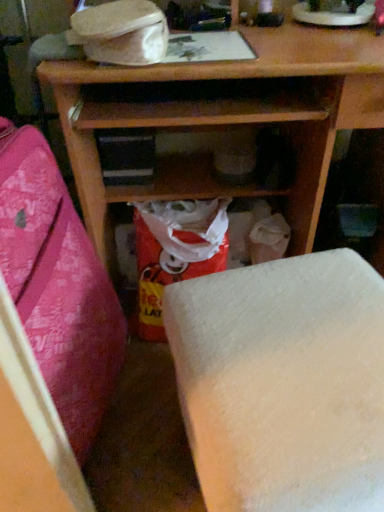
Question: Which direction should I rotate to look at white matte foam at lower center, which appears as the 2th furniture when viewed from the left?

Choices:
 (A) left
 (B) right

Answer: (B)

Question: Does matte plastic bag at center have a larger size compared to wooden shelf at center, which ranks as the 2th furniture in right-to-left order?

Choices:
 (A) no
 (B) yes

Answer: (A)

Question: Is matte plastic bag at center facing towards wooden shelf at center, which ranks as the 2th furniture in right-to-left order?

Choices:
 (A) no
 (B) yes

Answer: (A)

Question: Can you confirm if matte plastic bag at center is smaller than wooden shelf at center, marked as the first furniture in a left-to-right arrangement?

Choices:
 (A) yes
 (B) no

Answer: (A)

Question: Considering the relative positions of matte plastic bag at center and wooden shelf at center, marked as the first furniture in a left-to-right arrangement, in the image provided, is matte plastic bag at center to the right of wooden shelf at center, marked as the first furniture in a left-to-right arrangement, from the viewer's perspective?

Choices:
 (A) no
 (B) yes

Answer: (B)

Question: Is matte plastic bag at center looking in the opposite direction of wooden shelf at center, marked as the first furniture in a left-to-right arrangement?

Choices:
 (A) yes
 (B) no

Answer: (B)

Question: From the image's perspective, is matte plastic bag at center located above wooden shelf at center, which ranks as the 2th furniture in right-to-left order?

Choices:
 (A) yes
 (B) no

Answer: (A)

Question: Is there a large distance between wooden shelf at center, which ranks as the 2th furniture in right-to-left order, and matte plastic bag at center?

Choices:
 (A) yes
 (B) no

Answer: (B)

Question: Could matte plastic bag at center be considered to be inside wooden shelf at center, marked as the first furniture in a left-to-right arrangement?

Choices:
 (A) yes
 (B) no

Answer: (B)

Question: Considering the relative positions of wooden shelf at center, marked as the first furniture in a left-to-right arrangement, and matte plastic bag at center in the image provided, is wooden shelf at center, marked as the first furniture in a left-to-right arrangement, behind matte plastic bag at center?

Choices:
 (A) no
 (B) yes

Answer: (A)

Question: Can you confirm if wooden shelf at center, which ranks as the 2th furniture in right-to-left order, is taller than matte plastic bag at center?

Choices:
 (A) no
 (B) yes

Answer: (B)

Question: Is wooden shelf at center, which ranks as the 2th furniture in right-to-left order, next to matte plastic bag at center?

Choices:
 (A) no
 (B) yes

Answer: (A)

Question: From the image's perspective, would you say wooden shelf at center, which ranks as the 2th furniture in right-to-left order, is shown under matte plastic bag at center?

Choices:
 (A) yes
 (B) no

Answer: (A)

Question: Is white matte foam at lower center, placed as the first furniture when sorted from right to left, smaller than matte plastic bag at center?

Choices:
 (A) yes
 (B) no

Answer: (B)